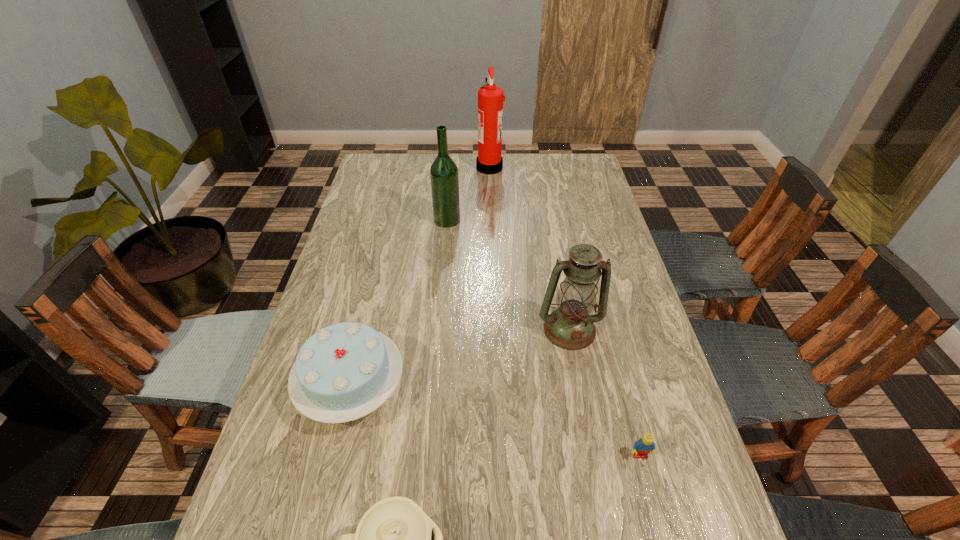
Locate an element on the screen. This screenshot has height=540, width=960. free space located 0.310m on the front of the alcohol is located at coordinates (441, 294).

The image size is (960, 540). I want to click on free space located on the front of the oil lamp, so coord(581,388).

Identify the location of free space located 0.120m on the right of the birthday cake. The height and width of the screenshot is (540, 960). (456, 387).

Locate an element on the screen. free location located on the face of the Lego is located at coordinates (652, 501).

Find the location of a particular element. The image size is (960, 540). object present at the far edge is located at coordinates (490, 98).

The width and height of the screenshot is (960, 540). I want to click on object that is at the left edge, so pyautogui.click(x=343, y=372).

Find the location of a particular element. oil lamp that is positioned at the right edge is located at coordinates (570, 326).

Where is `Lego situated at the right edge`? This screenshot has width=960, height=540. Lego situated at the right edge is located at coordinates (645, 445).

At what (x,y) coordinates should I click in order to perform the action: click on vacant space at the far edge of the desktop. Please return your answer as a coordinate pair (x, y). The height and width of the screenshot is (540, 960). Looking at the image, I should click on (520, 163).

Locate an element on the screen. This screenshot has height=540, width=960. free space at the left edge of the desktop is located at coordinates (340, 265).